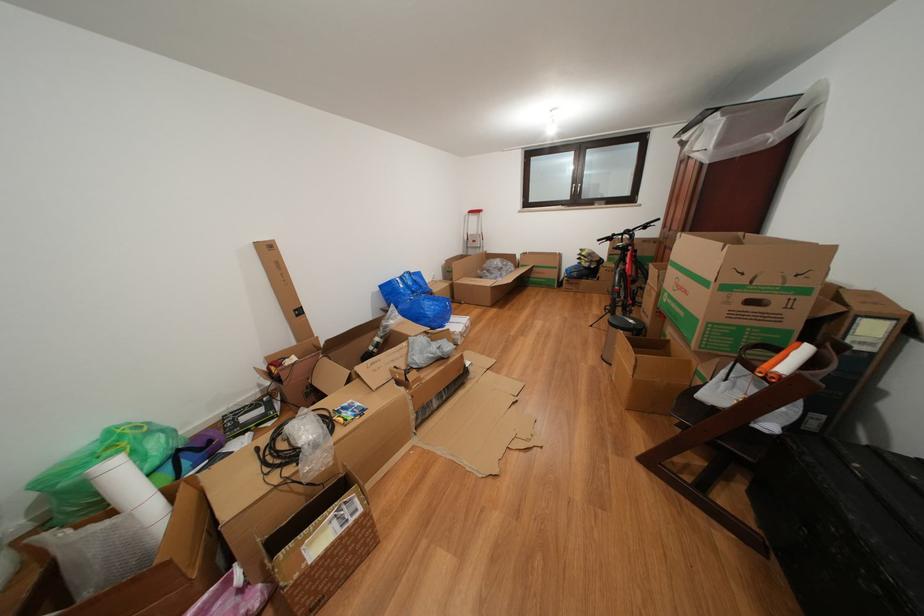
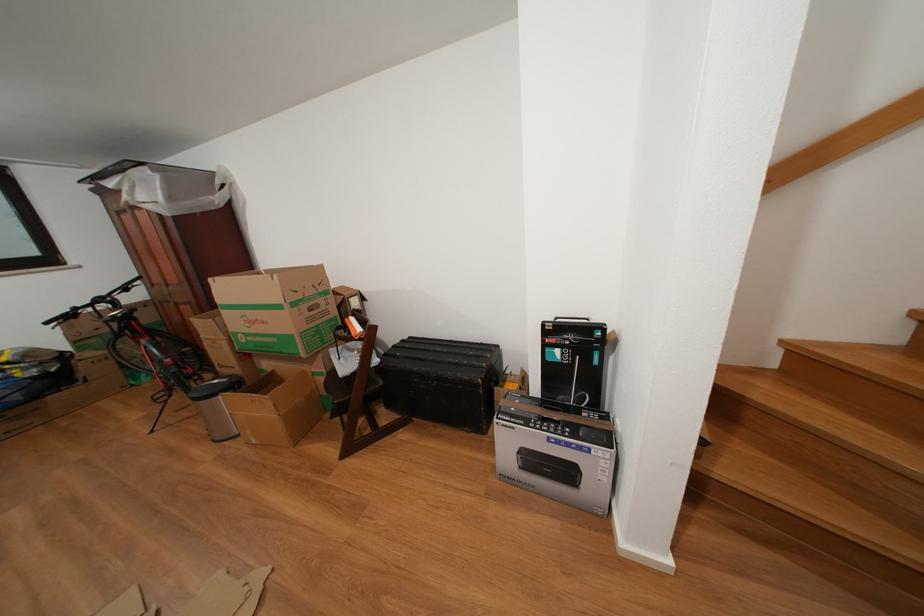
The point at (694, 297) is marked in the first image. Where is the corresponding point in the second image?

(272, 328)